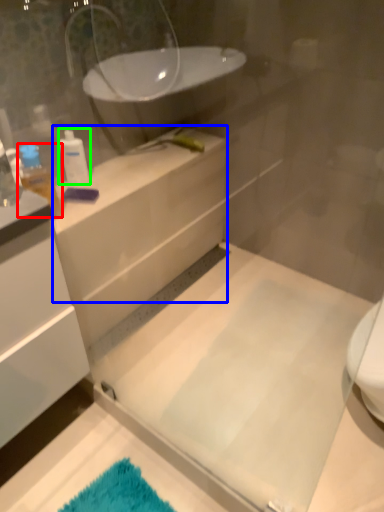
Question: Which is nearer to the toiletry (highlighted by a red box)? counter top (highlighted by a blue box) or toiletry (highlighted by a green box).

Choices:
 (A) counter top
 (B) toiletry

Answer: (B)